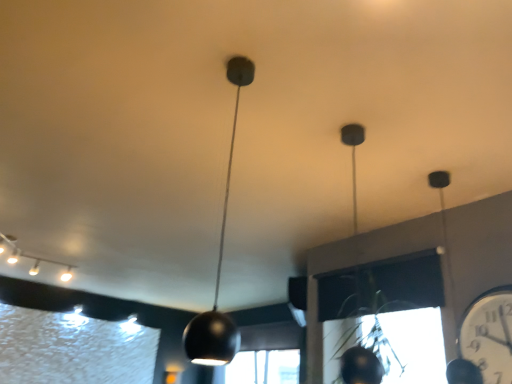
What do you see at coordinates (31, 258) in the screenshot? I see `white glossy track lights at upper left, marked as the second lamp in a right-to-left arrangement` at bounding box center [31, 258].

This screenshot has height=384, width=512. Describe the element at coordinates (489, 335) in the screenshot. I see `white glossy clock at right` at that location.

The width and height of the screenshot is (512, 384). What do you see at coordinates (219, 265) in the screenshot? I see `matte black pendant light at center, marked as the second lamp in a back-to-front arrangement` at bounding box center [219, 265].

Identify the location of white glossy track lights at upper left, positioned as the 1th lamp in back-to-front order. (31, 258).

From the image's perspective, who appears lower, white glossy track lights at upper left, marked as the second lamp in a right-to-left arrangement, or matte black pendant light at center, marked as the second lamp in a back-to-front arrangement?

white glossy track lights at upper left, marked as the second lamp in a right-to-left arrangement, appears lower in the image.

Consider the image. Considering the sizes of objects white glossy track lights at upper left, positioned as the 1th lamp in back-to-front order, and matte black pendant light at center, the second lamp positioned from the left, in the image provided, who is shorter, white glossy track lights at upper left, positioned as the 1th lamp in back-to-front order, or matte black pendant light at center, the second lamp positioned from the left,?

With less height is white glossy track lights at upper left, positioned as the 1th lamp in back-to-front order.

How many degrees apart are the facing directions of white glossy track lights at upper left, marked as the second lamp in a right-to-left arrangement, and matte black pendant light at center, the 1th lamp positioned from the front?

165 degrees.

Is white glossy track lights at upper left, the 2th lamp viewed from the front, beside matte black pendant light at center, which is the first lamp from right to left?

No, white glossy track lights at upper left, the 2th lamp viewed from the front, is not next to matte black pendant light at center, which is the first lamp from right to left.

Can you confirm if white glossy clock at right is taller than white glossy track lights at upper left, which ranks as the 1th lamp in left-to-right order?

Yes.

Considering the relative positions of white glossy clock at right and white glossy track lights at upper left, marked as the second lamp in a right-to-left arrangement, in the image provided, is white glossy clock at right in front of white glossy track lights at upper left, marked as the second lamp in a right-to-left arrangement,?

Yes, the depth of white glossy clock at right is less than that of white glossy track lights at upper left, marked as the second lamp in a right-to-left arrangement.

Would you say white glossy clock at right is to the left or to the right of white glossy track lights at upper left, marked as the second lamp in a right-to-left arrangement, in the picture?

white glossy clock at right is to the right of white glossy track lights at upper left, marked as the second lamp in a right-to-left arrangement.

Is there a large distance between white glossy clock at right and matte black pendant light at center, the second lamp positioned from the left?

Indeed, white glossy clock at right is not near matte black pendant light at center, the second lamp positioned from the left.

In terms of height, does white glossy clock at right look taller or shorter compared to matte black pendant light at center, the second lamp positioned from the left?

white glossy clock at right is shorter than matte black pendant light at center, the second lamp positioned from the left.

From a real-world perspective, which object rests below the other?

white glossy clock at right is physically lower.

Considering the positions of objects white glossy clock at right and matte black pendant light at center, marked as the second lamp in a back-to-front arrangement, in the image provided, who is more to the left, white glossy clock at right or matte black pendant light at center, marked as the second lamp in a back-to-front arrangement,?

From the viewer's perspective, matte black pendant light at center, marked as the second lamp in a back-to-front arrangement, appears more on the left side.

Where is `clock lying on the right of white glossy track lights at upper left, marked as the second lamp in a right-to-left arrangement`? clock lying on the right of white glossy track lights at upper left, marked as the second lamp in a right-to-left arrangement is located at coordinates (489, 335).

Considering the positions of objects white glossy track lights at upper left, positioned as the 1th lamp in back-to-front order, and white glossy clock at right in the image provided, who is more to the right, white glossy track lights at upper left, positioned as the 1th lamp in back-to-front order, or white glossy clock at right?

white glossy clock at right.

Is white glossy track lights at upper left, positioned as the 1th lamp in back-to-front order, not close to white glossy clock at right?

Yes, white glossy track lights at upper left, positioned as the 1th lamp in back-to-front order, and white glossy clock at right are located far from each other.

Considering the relative sizes of white glossy track lights at upper left, which ranks as the 1th lamp in left-to-right order, and white glossy clock at right in the image provided, is white glossy track lights at upper left, which ranks as the 1th lamp in left-to-right order, smaller than white glossy clock at right?

Actually, white glossy track lights at upper left, which ranks as the 1th lamp in left-to-right order, might be larger than white glossy clock at right.

From the picture: From a real-world perspective, is matte black pendant light at center, the 1th lamp positioned from the front, physically below white glossy track lights at upper left, marked as the second lamp in a right-to-left arrangement?

Yes, from a real-world perspective, matte black pendant light at center, the 1th lamp positioned from the front, is beneath white glossy track lights at upper left, marked as the second lamp in a right-to-left arrangement.

Considering the relative sizes of matte black pendant light at center, which is the first lamp from right to left, and white glossy track lights at upper left, the 2th lamp viewed from the front, in the image provided, is matte black pendant light at center, which is the first lamp from right to left, thinner than white glossy track lights at upper left, the 2th lamp viewed from the front,?

Correct, the width of matte black pendant light at center, which is the first lamp from right to left, is less than that of white glossy track lights at upper left, the 2th lamp viewed from the front.

Which is closer to the camera, (228, 344) or (39, 262)?

The point (228, 344) is closer to the camera.

What's the angular difference between matte black pendant light at center, which is the first lamp from right to left, and white glossy track lights at upper left, marked as the second lamp in a right-to-left arrangement,'s facing directions?

165 degrees.

Is matte black pendant light at center, which is the first lamp from right to left, in front of white glossy clock at right?

Yes, it is in front of white glossy clock at right.

Can you tell me how much matte black pendant light at center, which is the first lamp from right to left, and white glossy clock at right differ in facing direction?

The angular difference between matte black pendant light at center, which is the first lamp from right to left, and white glossy clock at right is 92.8 degrees.

Do you think matte black pendant light at center, the 1th lamp positioned from the front, is within white glossy clock at right, or outside of it?

The correct answer is: outside.

Is matte black pendant light at center, the second lamp positioned from the left, looking in the opposite direction of white glossy clock at right?

matte black pendant light at center, the second lamp positioned from the left, does not have its back to white glossy clock at right.

The width and height of the screenshot is (512, 384). I want to click on lamp below the white glossy track lights at upper left, which ranks as the 1th lamp in left-to-right order (from a real-world perspective), so click(x=219, y=265).

The image size is (512, 384). What are the coordinates of `lamp behind the white glossy clock at right` in the screenshot? It's located at pos(31,258).

When comparing their distances from matte black pendant light at center, which is the first lamp from right to left, does white glossy clock at right or white glossy track lights at upper left, which ranks as the 1th lamp in left-to-right order, seem further?

white glossy track lights at upper left, which ranks as the 1th lamp in left-to-right order, is further to matte black pendant light at center, which is the first lamp from right to left.

When comparing their distances from white glossy track lights at upper left, which ranks as the 1th lamp in left-to-right order, does white glossy clock at right or matte black pendant light at center, the 1th lamp positioned from the front, seem closer?

matte black pendant light at center, the 1th lamp positioned from the front.

Looking at the image, which one is located further to white glossy track lights at upper left, marked as the second lamp in a right-to-left arrangement, matte black pendant light at center, which is the first lamp from right to left, or white glossy clock at right?

white glossy clock at right is positioned further to the anchor white glossy track lights at upper left, marked as the second lamp in a right-to-left arrangement.

From the image, which object appears to be farther from white glossy clock at right, white glossy track lights at upper left, which ranks as the 1th lamp in left-to-right order, or matte black pendant light at center, marked as the second lamp in a back-to-front arrangement?

white glossy track lights at upper left, which ranks as the 1th lamp in left-to-right order, lies further to white glossy clock at right than the other object.

Considering their positions, is white glossy track lights at upper left, positioned as the 1th lamp in back-to-front order, positioned further to matte black pendant light at center, marked as the second lamp in a back-to-front arrangement, than white glossy clock at right?

white glossy track lights at upper left, positioned as the 1th lamp in back-to-front order, lies further to matte black pendant light at center, marked as the second lamp in a back-to-front arrangement, than the other object.

In the scene shown: Which object lies nearer to the anchor point white glossy clock at right, matte black pendant light at center, which is the first lamp from right to left, or white glossy track lights at upper left, which ranks as the 1th lamp in left-to-right order?

matte black pendant light at center, which is the first lamp from right to left, is positioned closer to the anchor white glossy clock at right.

What are the coordinates of `lamp between white glossy track lights at upper left, positioned as the 1th lamp in back-to-front order, and white glossy clock at right, in the horizontal direction` in the screenshot? It's located at (219, 265).